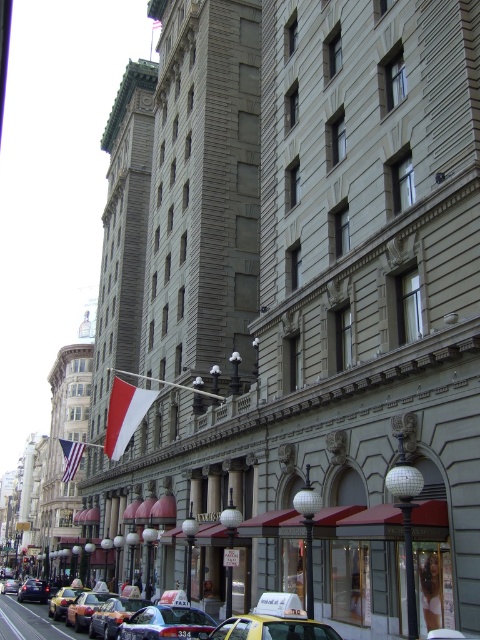
Can you confirm if white fabric flag at center is shorter than yellow metallic taxi at lower left?

Yes.

Is white fabric flag at center further to camera compared to yellow metallic taxi at lower left?

Yes, it is behind yellow metallic taxi at lower left.

Identify the location of white fabric flag at center. (124, 413).

This screenshot has width=480, height=640. I want to click on white fabric flag at center, so click(124, 413).

Is yellow metallic taxi at lower left further to camera compared to metallic silver taxi at center?

No, yellow metallic taxi at lower left is in front of metallic silver taxi at center.

Between point (66, 586) and point (31, 596), which one is positioned in front?

Point (31, 596) is more forward.

Locate an element on the screen. The width and height of the screenshot is (480, 640). yellow metallic taxi at lower left is located at coordinates (62, 600).

Looking at this image, between matte gray building at left and yellow matte taxi at lower center, which one appears on the left side from the viewer's perspective?

matte gray building at left is more to the left.

Which is in front, point (41, 545) or point (267, 637)?

Point (267, 637) is in front.

This screenshot has height=640, width=480. Find the location of `matte gray building at left`. matte gray building at left is located at coordinates (62, 458).